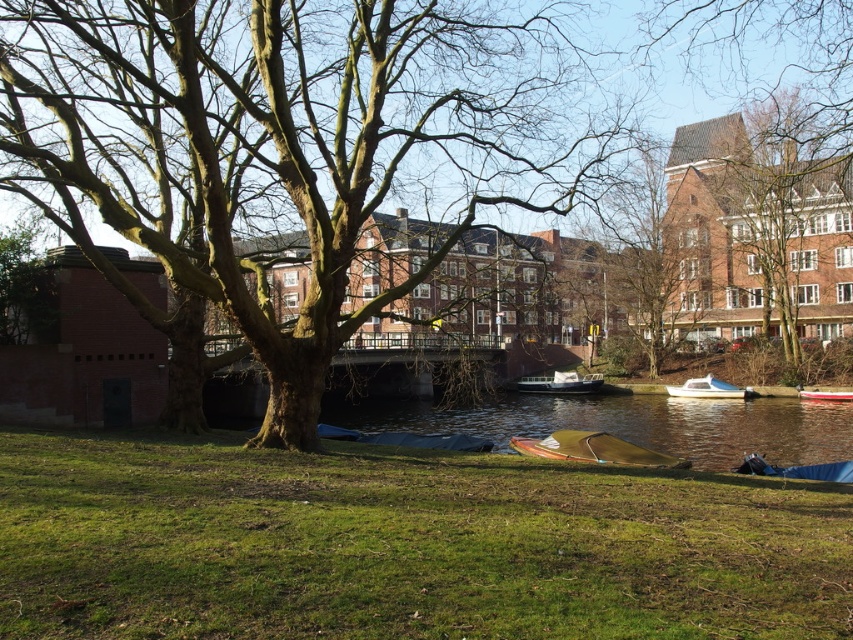
Question: Which object appears closest to the camera in this image?

Choices:
 (A) wooden canoe at center
 (B) green grass at lower center

Answer: (B)

Question: From the image, what is the correct spatial relationship of smooth brown tree trunk at center in relation to brown rough tree at upper center?

Choices:
 (A) left
 (B) right

Answer: (A)

Question: Which of the following is the farthest from the observer?

Choices:
 (A) smooth brown tree trunk at center
 (B) wooden canoe at center
 (C) white glossy boat at center
 (D) brown rough tree at upper center

Answer: (C)

Question: Which object is positioned farthest from the white glossy boat at center-right?

Choices:
 (A) green grass at lower center
 (B) smooth brown tree trunk at center

Answer: (A)

Question: Is smooth brown tree trunk at center thinner than brown rough tree at upper center?

Choices:
 (A) yes
 (B) no

Answer: (B)

Question: Is brown rough tree at upper center above red plastic boat at lower right?

Choices:
 (A) yes
 (B) no

Answer: (A)